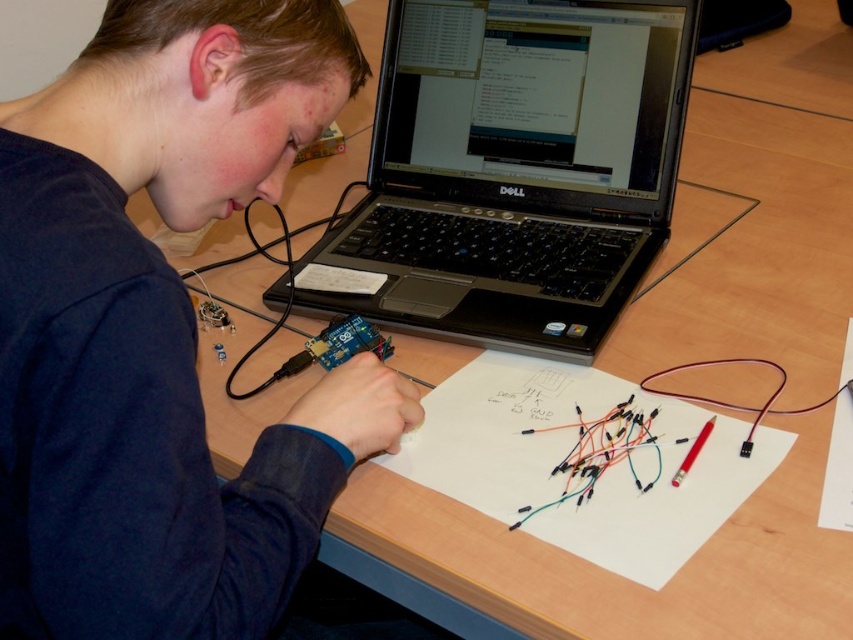
You are organizing a desk and need to place a new item between the dark blue fabric at upper left and the black plastic laptop at center. Which object should you place the item closer to if you want it to be near the narrower side?

The dark blue fabric at upper left has a lesser width compared to the black plastic laptop at center, so you should place the item closer to the dark blue fabric at upper left to be near the narrower side.

You are standing in front of the desk and need to place a small object on the dark blue fabric at upper left. Where exactly should you place it on the desk?

The dark blue fabric at upper left is located at point (160, 330), so you should place the object at those coordinates on the desk.

You are standing at the point marked as point (363, 70) and want to take a photo of the entire desk setup. The camera you have can capture a clear image up to 70 centimeters away. Will the camera be able to capture the entire desk setup from your current position?

The distance between point (363, 70) and the camera is 73.49 centimeters, which exceeds the camera maximum range of 70 centimeters. Therefore, the camera will not be able to capture the entire desk setup clearly from your current position.